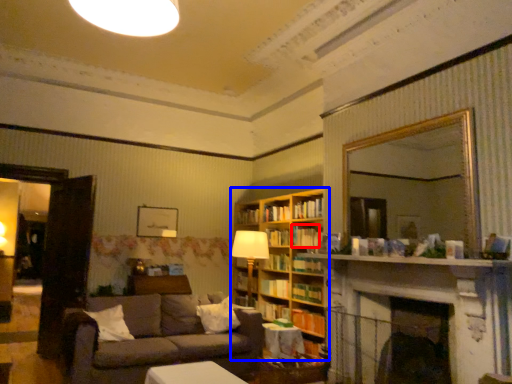
Question: Which point is further to the camera, book (highlighted by a red box) or bookcase (highlighted by a blue box)?

Choices:
 (A) book
 (B) bookcase

Answer: (A)